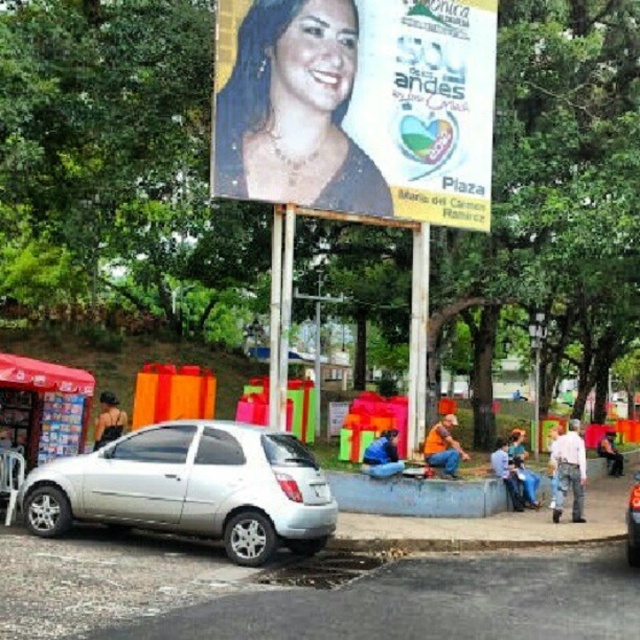
Question: Does silver metallic hatchback at lower left have a greater width compared to blue denim jeans at lower center?

Choices:
 (A) no
 (B) yes

Answer: (B)

Question: Does orange fabric bag at lower right have a lesser width compared to black fabric tank top at lower left?

Choices:
 (A) yes
 (B) no

Answer: (B)

Question: Which of these objects is positioned farthest from the smooth leather jacket at lower right?

Choices:
 (A) matte plastic billboard at upper center
 (B) blue denim jeans at lower right

Answer: (A)

Question: Which object appears closest to the camera in this image?

Choices:
 (A) blue denim jeans at lower right
 (B) silver metallic car at center
 (C) white cotton shirt at right
 (D) matte plastic billboard at upper center

Answer: (B)

Question: Which object is positioned farthest from the silver metallic hatchback at lower left?

Choices:
 (A) silver metallic car at center
 (B) matte plastic billboard at upper center
 (C) blue denim jeans at lower right
 (D) white cotton shirt at right

Answer: (B)

Question: Does silver metallic hatchback at lower left appear on the right side of orange fabric bag at lower right?

Choices:
 (A) no
 (B) yes

Answer: (A)